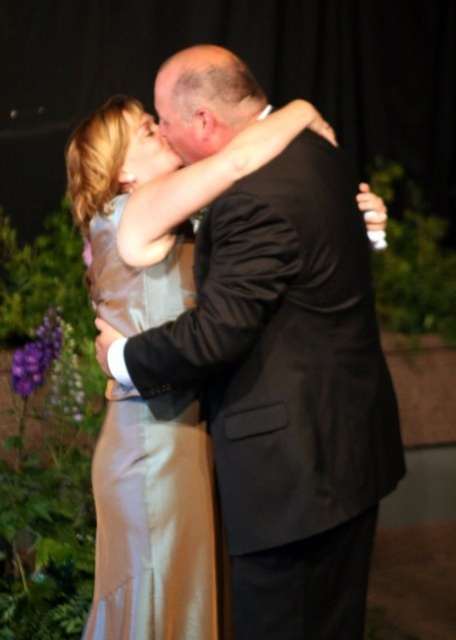
You are a photographer at a formal event. You need to capture a photo of the satin dress at center and the bald head at center. Based on their positions, which one is closer to the bottom of the image?

The satin dress at center is below bald head at center, so the satin dress at center is closer to the bottom of the image.

You are a photographer standing at the camera position. You want to capture a closeup of the satin dress at center. Given that your camera can focus on objects within 4 feet, will the dress be in focus?

The satin dress at center is 4.38 feet from the camera, which is slightly beyond the 4 feet focusing range. Therefore, the dress will not be in focus.

You are a photographer at the event and want to capture the couple in a way that highlights the shimmering texture of the woman in the light. You notice a point at coordinates point (155, 524). Based on the scene description, where is this point located?

The point (155, 524) is on the satin dress at left.